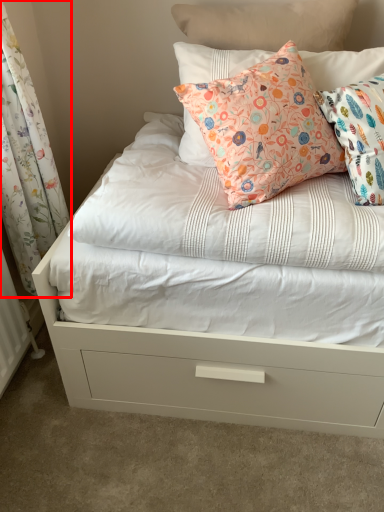
Question: From the image's perspective, considering the relative positions of curtain (annotated by the red box) and pillow in the image provided, where is curtain (annotated by the red box) located with respect to the staircase?

Choices:
 (A) above
 (B) below

Answer: (B)